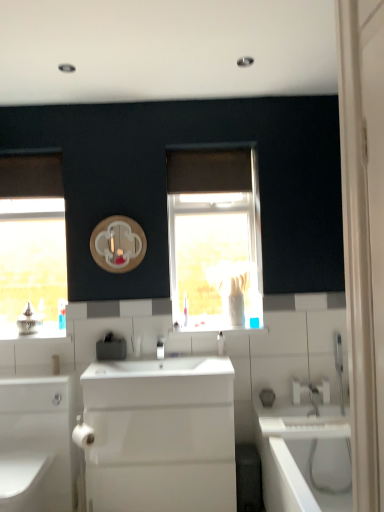
The image size is (384, 512). I want to click on white glossy soap dispenser at center, so click(x=221, y=343).

Locate an element on the screen. The image size is (384, 512). white glossy tap at center is located at coordinates (160, 348).

In order to face wooden circle at center, should I rotate leftwards or rightwards?

To face it directly, rotate left by 9.834 degrees.

What is the approximate width of white glossy cabinet at lower left?

Answer: The width of white glossy cabinet at lower left is 27.27 inches.

I want to click on satin black soap dispenser at center, so click(x=111, y=348).

At what (x,y) coordinates should I click in order to perform the action: click on white glossy soap dispenser at center. Please return your answer as a coordinate pair (x, y). Image resolution: width=384 pixels, height=512 pixels. Looking at the image, I should click on (221, 343).

Which object is wider, white glossy bathtub at lower right or satin black soap dispenser at center?

Wider between the two is white glossy bathtub at lower right.

Between white glossy bathtub at lower right and satin black soap dispenser at center, which one has less height?

With less height is satin black soap dispenser at center.

Considering the relative positions of white glossy bathtub at lower right and satin black soap dispenser at center in the image provided, is white glossy bathtub at lower right to the left of satin black soap dispenser at center from the viewer's perspective?

No, white glossy bathtub at lower right is not to the left of satin black soap dispenser at center.

Does white glossy sink at center have a greater height compared to white glossy bathtub at lower right?

Yes, white glossy sink at center is taller than white glossy bathtub at lower right.

Which of these two, white glossy sink at center or white glossy bathtub at lower right, is bigger?

white glossy bathtub at lower right.

Is the surface of white glossy sink at center in direct contact with white glossy bathtub at lower right?

No, white glossy sink at center is not making contact with white glossy bathtub at lower right.

Can you tell me how much wooden circle at center and white glossy sink at center differ in facing direction?

There is a 0.453-degree angle between the facing directions of wooden circle at center and white glossy sink at center.

From the image's perspective, which object appears higher, wooden circle at center or white glossy sink at center?

From the image's view, wooden circle at center is above.

You are a GUI agent. You are given a task and a screenshot of the screen. Output one action in this format:
    pyautogui.click(x=<x>, y=<y>)
    Task: Click on the sink to the right of wooden circle at center
    The width and height of the screenshot is (384, 512).
    Given the screenshot: What is the action you would take?
    pyautogui.click(x=159, y=435)

From a real-world perspective, who is located lower, wooden circle at center or white glossy sink at center?

white glossy sink at center, from a real-world perspective.

From the image's perspective, who appears lower, wooden circle at center or white glossy tap at center?

white glossy tap at center, from the image's perspective.

Which point is more distant from viewer, (x=125, y=220) or (x=163, y=358)?

The point (x=125, y=220) is farther.

Which object is further away from the camera, wooden circle at center or white glossy tap at center?

wooden circle at center is behind.

How different are the orientations of white glossy soap dispenser at center and white glossy tap at center in degrees?

0.155 degrees separate the facing orientations of white glossy soap dispenser at center and white glossy tap at center.

Is white glossy soap dispenser at center located outside white glossy tap at center?

Yes, white glossy soap dispenser at center is not within white glossy tap at center.

Does white glossy soap dispenser at center have a greater width compared to white glossy tap at center?

Incorrect, the width of white glossy soap dispenser at center does not surpass that of white glossy tap at center.

Is satin black soap dispenser at center not near wooden circle at center?

satin black soap dispenser at center is actually quite close to wooden circle at center.

Visually, is satin black soap dispenser at center positioned to the left or to the right of wooden circle at center?

Based on their positions, satin black soap dispenser at center is located to the left of wooden circle at center.

From a real-world perspective, which object rests below the other?

In real-world perspective, satin black soap dispenser at center is lower.

Is satin black soap dispenser at center taller or shorter than wooden circle at center?

Clearly, satin black soap dispenser at center is shorter compared to wooden circle at center.

Is white glossy tap at center next to satin black soap dispenser at center?

white glossy tap at center and satin black soap dispenser at center are not in contact.

Between point (164, 340) and point (107, 353), which one is positioned in front?

Positioned in front is point (107, 353).

Is white glossy tap at center smaller than satin black soap dispenser at center?

Yes, white glossy tap at center is smaller than satin black soap dispenser at center.

From their relative heights in the image, would you say white glossy tap at center is taller or shorter than satin black soap dispenser at center?

Considering their sizes, white glossy tap at center has more height than satin black soap dispenser at center.

Image resolution: width=384 pixels, height=512 pixels. Identify the location of bath in front of the satin black soap dispenser at center. (303, 456).

Identify the location of bath below the white glossy sink at center (from the image's perspective). The image size is (384, 512). (303, 456).

Looking at the image, which one is located further to white glossy cabinet at lower left, satin black soap dispenser at center or white glossy sink at center?

Based on the image, satin black soap dispenser at center appears to be further to white glossy cabinet at lower left.

Estimate the real-world distances between objects in this image. Which object is further from white glossy sink at center, white glossy cabinet at lower left or white glossy tap at center?

The object further to white glossy sink at center is white glossy tap at center.

Based on the photo, when comparing their distances from white glossy tap at center, does satin black soap dispenser at center or white glossy cabinet at lower left seem closer?

satin black soap dispenser at center.

From the image, which object appears to be farther from white glossy bathtub at lower right, satin black soap dispenser at center or white glossy cabinet at lower left?

white glossy cabinet at lower left.

Estimate the real-world distances between objects in this image. Which object is further from white glossy bathtub at lower right, wooden circle at center or satin black soap dispenser at center?

wooden circle at center.

Looking at this image, estimate the real-world distances between objects in this image. Which object is closer to white glossy sink at center, wooden circle at center or white glossy soap dispenser at center?

Among the two, white glossy soap dispenser at center is located nearer to white glossy sink at center.

Based on their spatial positions, is white glossy bathtub at lower right or white glossy soap dispenser at center further from white glossy cabinet at lower left?

white glossy bathtub at lower right is further to white glossy cabinet at lower left.

Estimate the real-world distances between objects in this image. Which object is further from wooden circle at center, white glossy sink at center or white glossy tap at center?

white glossy sink at center.

The image size is (384, 512). Find the location of `tap between wooden circle at center and white glossy sink at center vertically`. tap between wooden circle at center and white glossy sink at center vertically is located at coordinates (160, 348).

You are a GUI agent. You are given a task and a screenshot of the screen. Output one action in this format:
    pyautogui.click(x=<x>, y=<y>)
    Task: Click on the sink between white glossy cabinet at lower left and white glossy bathtub at lower right from left to right
    
    Given the screenshot: What is the action you would take?
    pyautogui.click(x=159, y=435)

Locate an element on the screen. mirror between satin black soap dispenser at center and white glossy soap dispenser at center in the horizontal direction is located at coordinates (118, 244).

Locate an element on the screen. The image size is (384, 512). tap between satin black soap dispenser at center and white glossy bathtub at lower right in the horizontal direction is located at coordinates (160, 348).